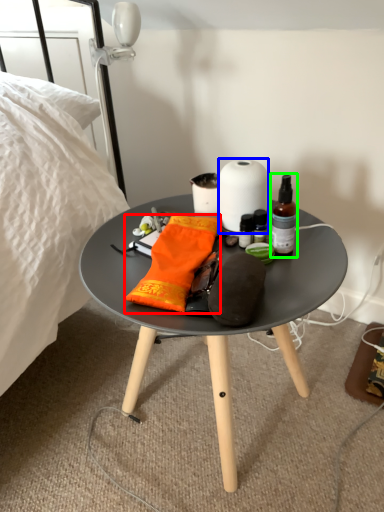
Question: Considering the real-world distances, which object is farthest from material (highlighted by a red box)? paper towel (highlighted by a blue box) or bottle (highlighted by a green box)?

Choices:
 (A) paper towel
 (B) bottle

Answer: (B)